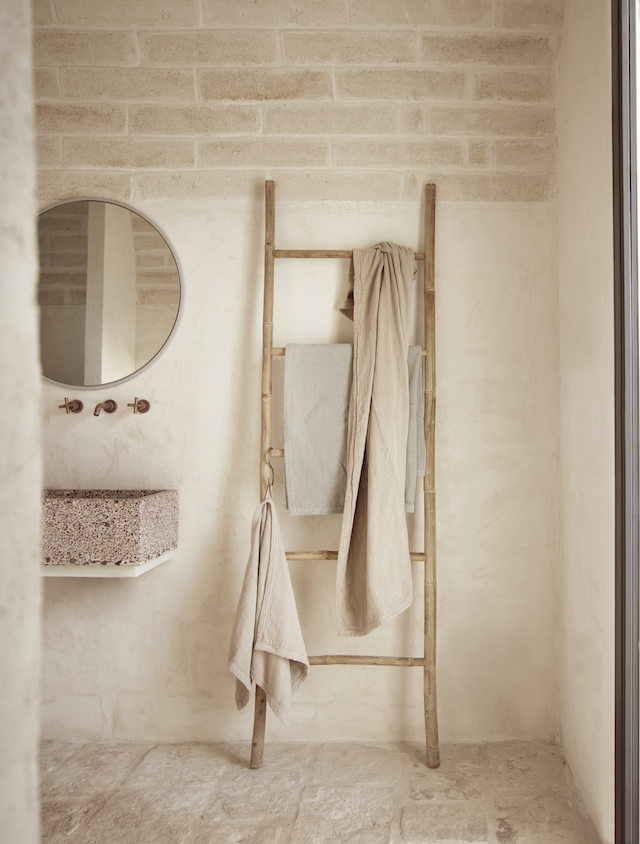
Locate an element on the screen. floor is located at coordinates (337, 820).